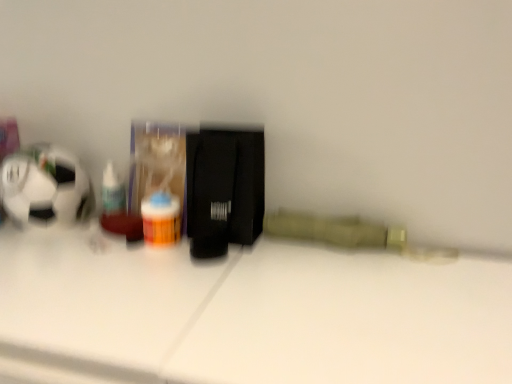
This screenshot has width=512, height=384. What are the coordinates of `space that is in front of translucent plastic bottle at left` in the screenshot? It's located at (82, 255).